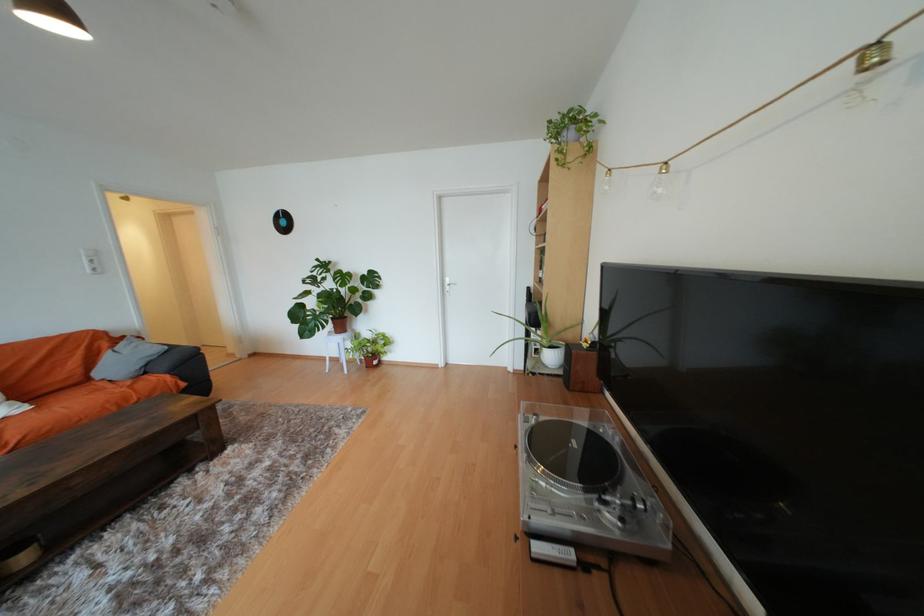
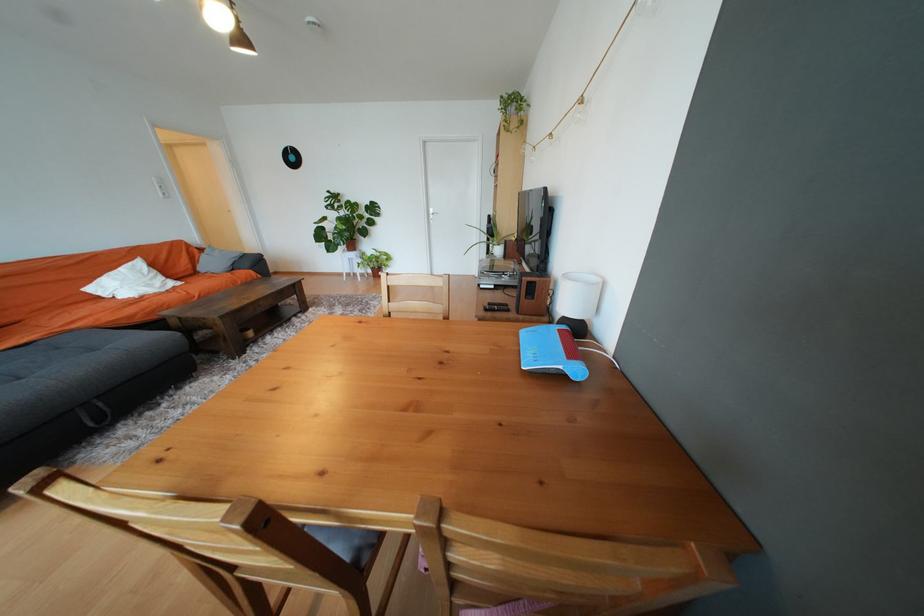
In the second image, find the point that corresponds to (x=112, y=346) in the first image.

(202, 252)